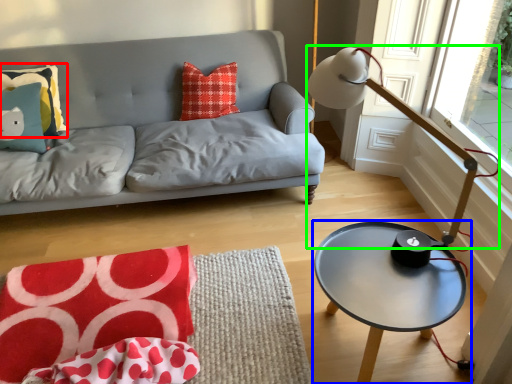
Question: Estimate the real-world distances between objects in this image. Which object is farther from pillow (highlighted by a red box), coffee table (highlighted by a blue box) or table lamp (highlighted by a green box)?

Choices:
 (A) coffee table
 (B) table lamp

Answer: (A)